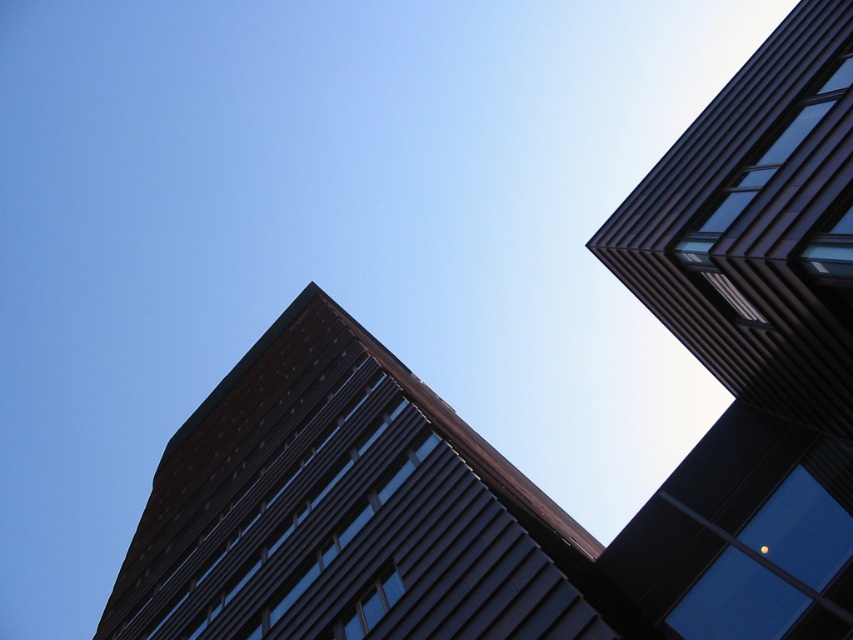
Looking at this image, you are standing at the base of the two buildings and want to take a photo that includes both the metallic glass building at upper right and the dark brown glass building at center. Which building should you position closer to in order to capture both in the frame?

You should position closer to the metallic glass building at upper right because the dark brown glass building at center is behind it, allowing both to be in the frame when closer to the foreground building.

You are an architect analyzing the two buildings in the image. Which building has a narrower width between the metallic glass building at upper right and the dark brown glass building at center?

The metallic glass building at upper right has a lesser width compared to the dark brown glass building at center, so it is narrower.

You are standing at the base of the two buildings and want to determine which point is closer to you. The points are labeled as point 1 at coordinates point (727,518) and point 2 at coordinates point (482,554). Which point is closer to your position?

Point (727,518) is further to the viewer than point (482,554). Therefore, point (482,554) is closer to you.